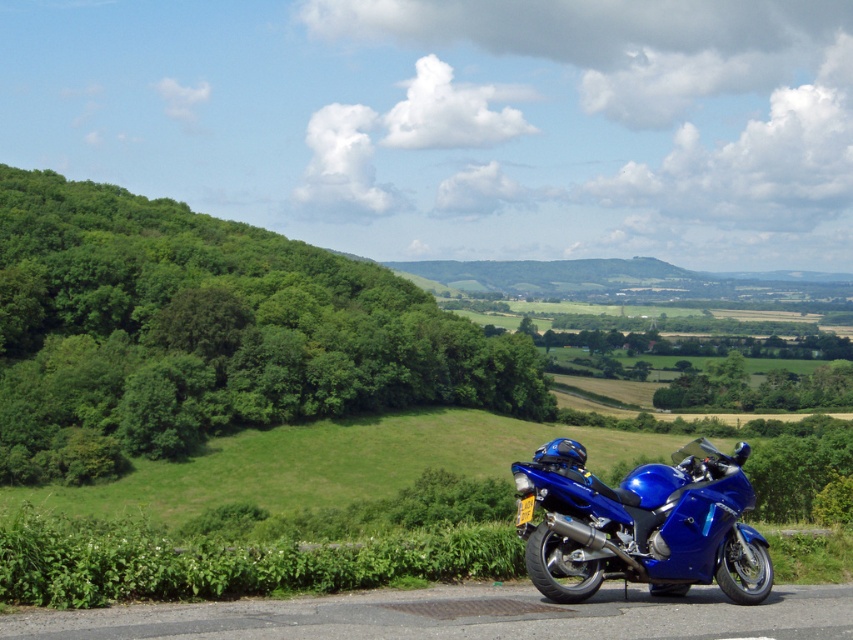
Is green leafy tree at left to the left of blue metallic motorcycle at lower right from the viewer's perspective?

Indeed, green leafy tree at left is positioned on the left side of blue metallic motorcycle at lower right.

Does green leafy tree at left come behind blue metallic motorcycle at lower right?

Yes.

Between point (93, 205) and point (519, 476), which one is positioned behind?

Positioned behind is point (93, 205).

This screenshot has width=853, height=640. What are the coordinates of `green leafy tree at left` in the screenshot? It's located at (206, 333).